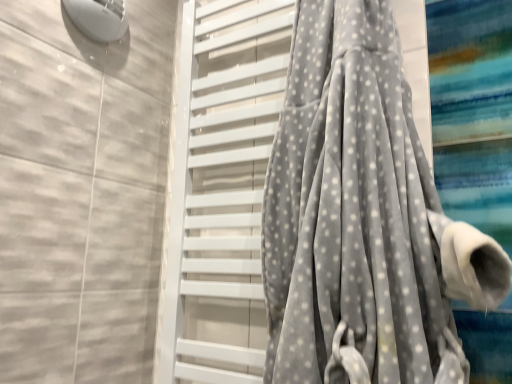
Question: Does gray velvety towel at center appear on the left side of gray velvety curtain at center?

Choices:
 (A) yes
 (B) no

Answer: (A)

Question: Does gray velvety towel at center have a lesser height compared to gray velvety curtain at center?

Choices:
 (A) yes
 (B) no

Answer: (B)

Question: Does gray velvety towel at center have a greater height compared to gray velvety curtain at center?

Choices:
 (A) yes
 (B) no

Answer: (A)

Question: Is the depth of gray velvety towel at center less than that of gray velvety curtain at center?

Choices:
 (A) no
 (B) yes

Answer: (A)

Question: Is gray velvety towel at center at the right side of gray velvety curtain at center?

Choices:
 (A) yes
 (B) no

Answer: (B)

Question: From the image's perspective, is gray velvety towel at center located above gray velvety curtain at center?

Choices:
 (A) no
 (B) yes

Answer: (A)

Question: Can you confirm if gray velvety curtain at center is bigger than gray velvety towel at center?

Choices:
 (A) yes
 (B) no

Answer: (A)

Question: From the image's perspective, is gray velvety curtain at center over gray velvety towel at center?

Choices:
 (A) yes
 (B) no

Answer: (A)

Question: Is gray velvety curtain at center at the right side of gray velvety towel at center?

Choices:
 (A) yes
 (B) no

Answer: (A)

Question: From a real-world perspective, is gray velvety curtain at center physically below gray velvety towel at center?

Choices:
 (A) no
 (B) yes

Answer: (B)

Question: Can you confirm if gray velvety curtain at center is wider than gray velvety towel at center?

Choices:
 (A) yes
 (B) no

Answer: (A)

Question: Is gray velvety curtain at center oriented towards gray velvety towel at center?

Choices:
 (A) yes
 (B) no

Answer: (B)

Question: Considering the positions of gray velvety curtain at center and gray velvety towel at center in the image, is gray velvety curtain at center taller or shorter than gray velvety towel at center?

Choices:
 (A) short
 (B) tall

Answer: (A)